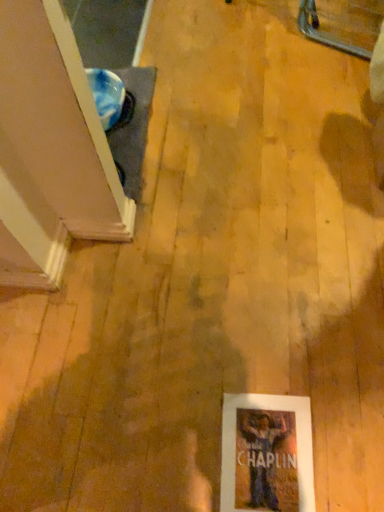
Find the location of a particular element. The width and height of the screenshot is (384, 512). free region under white paper poster at lower center (from a real-world perspective) is located at coordinates (262, 454).